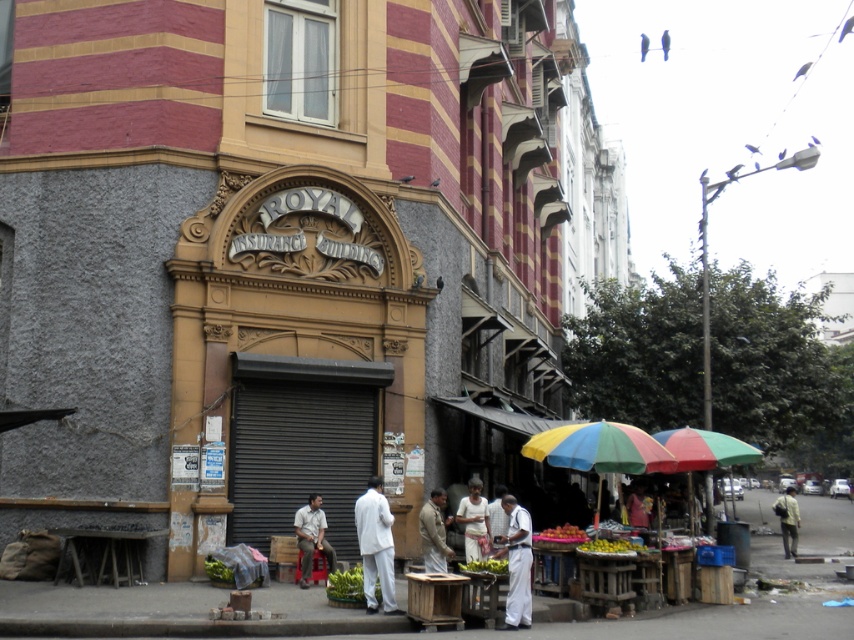
Who is positioned more to the right, white matte coat at center or shiny red apples at lower center?

shiny red apples at lower center is more to the right.

Between white matte coat at center and shiny red apples at lower center, which one is positioned higher?

white matte coat at center is higher up.

Is point (385, 536) less distant than point (562, 534)?

Yes.

At what (x,y) coordinates should I click in order to perform the action: click on white matte coat at center. Please return your answer as a coordinate pair (x, y). This screenshot has height=640, width=854. Looking at the image, I should click on (375, 545).

Does white matte coat at center have a larger size compared to white cotton shirt at center?

Actually, white matte coat at center might be smaller than white cotton shirt at center.

Who is positioned more to the right, white matte coat at center or white cotton shirt at center?

Positioned to the right is white cotton shirt at center.

The image size is (854, 640). Identify the location of white matte coat at center. (375, 545).

The image size is (854, 640). I want to click on white matte coat at center, so click(375, 545).

Between point (502, 500) and point (619, 552), which one is positioned behind?

The point (502, 500) is behind.

Does white cotton shirt at center have a lesser height compared to yellow matte fruit at lower center?

No.

Does point (515, 564) come closer to viewer compared to point (594, 540)?

Yes, it is.

You are a GUI agent. You are given a task and a screenshot of the screen. Output one action in this format:
    pyautogui.click(x=<x>, y=<y>)
    Task: Click on the white cotton shirt at center
    
    Given the screenshot: What is the action you would take?
    pyautogui.click(x=516, y=563)